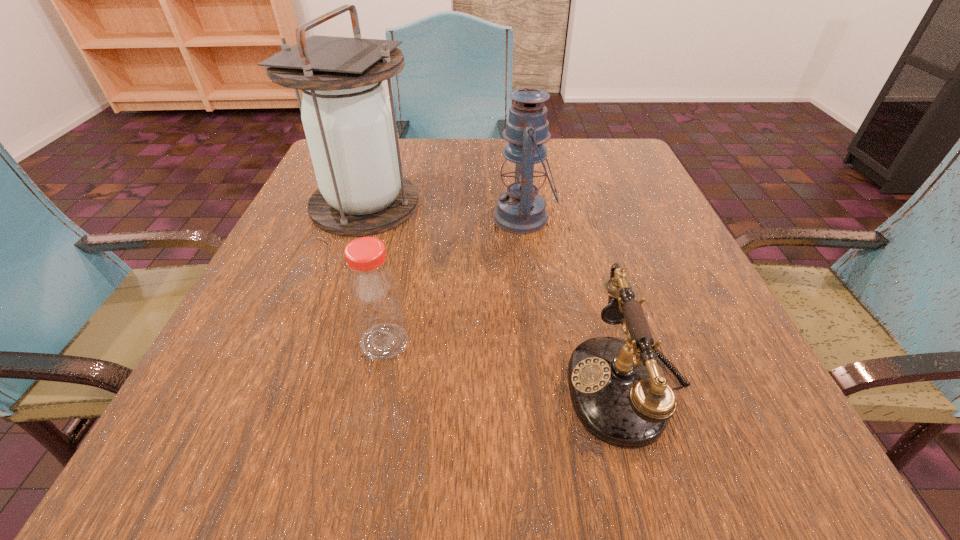
The height and width of the screenshot is (540, 960). Find the location of `vacant area that lies between the third tallest object and the shorter lantern`. vacant area that lies between the third tallest object and the shorter lantern is located at coordinates (454, 280).

You are a GUI agent. You are given a task and a screenshot of the screen. Output one action in this format:
    pyautogui.click(x=<x>, y=<y>)
    Task: Click on the free point between the right lantern and the bottle
    The width and height of the screenshot is (960, 540).
    Given the screenshot: What is the action you would take?
    pyautogui.click(x=454, y=280)

The width and height of the screenshot is (960, 540). Find the location of `vacant space in between the telephone and the shorter lantern`. vacant space in between the telephone and the shorter lantern is located at coordinates (575, 301).

Identify the location of empty space between the left lantern and the third shortest object. This screenshot has width=960, height=540. (444, 212).

Choose which object is the second nearest neighbor to the taller lantern. Please provide its 2D coordinates. Your answer should be formatted as a tuple, i.e. [(x, y)], where the tuple contains the x and y coordinates of a point satisfying the conditions above.

[(373, 292)]

Locate an element on the screen. the second closest object relative to the bottle is located at coordinates (618, 394).